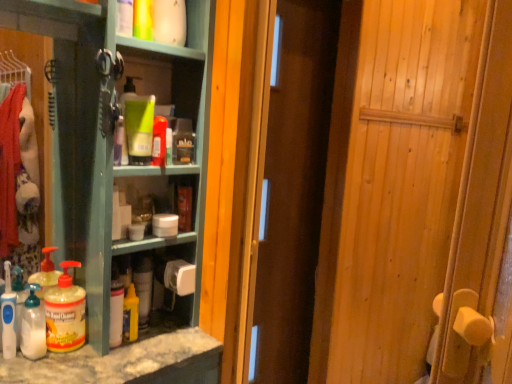
Question: From a real-world perspective, is green matte bottle at center, placed as the 4th cleaning product when sorted from bottom to top, below translucent plastic bottle at lower left, positioned as the first bottle in left-to-right order?

Choices:
 (A) yes
 (B) no

Answer: (B)

Question: Could you tell me if green matte bottle at center, which appears as the 4th cleaning product when viewed from the left, is facing translucent plastic bottle at lower left, positioned as the first bottle in left-to-right order?

Choices:
 (A) no
 (B) yes

Answer: (A)

Question: Is green matte bottle at center, which appears as the 4th cleaning product when viewed from the left, wider than translucent plastic bottle at lower left, positioned as the first bottle in left-to-right order?

Choices:
 (A) no
 (B) yes

Answer: (A)

Question: From the image's perspective, is green matte bottle at center, which ranks as the 1th cleaning product in top-to-bottom order, below translucent plastic bottle at lower left, positioned as the first bottle in left-to-right order?

Choices:
 (A) no
 (B) yes

Answer: (A)

Question: From the image's perspective, is green matte bottle at center, acting as the first cleaning product starting from the right, on top of translucent plastic bottle at lower left, positioned as the first bottle in left-to-right order?

Choices:
 (A) yes
 (B) no

Answer: (A)

Question: From the image's perspective, relative to translucent plastic bottle at lower left, placed as the second bottle when sorted from right to left, is wooden door at center, the 2th door positioned from the front, above or below?

Choices:
 (A) above
 (B) below

Answer: (A)

Question: From a real-world perspective, is wooden door at center, acting as the first door starting from the back, above or below translucent plastic bottle at lower left, positioned as the first bottle in left-to-right order?

Choices:
 (A) below
 (B) above

Answer: (B)

Question: Is wooden door at center, acting as the first door starting from the back, bigger or smaller than translucent plastic bottle at lower left, positioned as the first bottle in left-to-right order?

Choices:
 (A) big
 (B) small

Answer: (A)

Question: In terms of height, does wooden door at center, acting as the first door starting from the back, look taller or shorter compared to translucent plastic bottle at lower left, placed as the second bottle when sorted from right to left?

Choices:
 (A) short
 (B) tall

Answer: (B)

Question: Does point (123, 319) appear closer or farther from the camera than point (258, 294)?

Choices:
 (A) farther
 (B) closer

Answer: (B)

Question: From the image's perspective, is yellow matte bottle at center, which is the third cleaning product in left-to-right order, located above or below wooden door at center, acting as the first door starting from the back?

Choices:
 (A) above
 (B) below

Answer: (B)

Question: Relative to wooden door at center, the 2th door positioned from the front, is yellow matte bottle at center, which is the third cleaning product in left-to-right order, in front or behind?

Choices:
 (A) front
 (B) behind

Answer: (A)

Question: Considering the positions of yellow matte bottle at center, the second cleaning product when ordered from right to left, and wooden door at center, the 2th door positioned from the front, in the image, is yellow matte bottle at center, the second cleaning product when ordered from right to left, wider or thinner than wooden door at center, the 2th door positioned from the front,?

Choices:
 (A) wide
 (B) thin

Answer: (B)

Question: From a real-world perspective, relative to wooden door at center, the 2th door positioned from the front, is white matte bottle at lower center, acting as the 1th bottle starting from the right, vertically above or below?

Choices:
 (A) below
 (B) above

Answer: (A)

Question: Is white matte bottle at lower center, positioned as the 2th bottle in left-to-right order, spatially inside wooden door at center, acting as the first door starting from the back, or outside of it?

Choices:
 (A) outside
 (B) inside

Answer: (A)